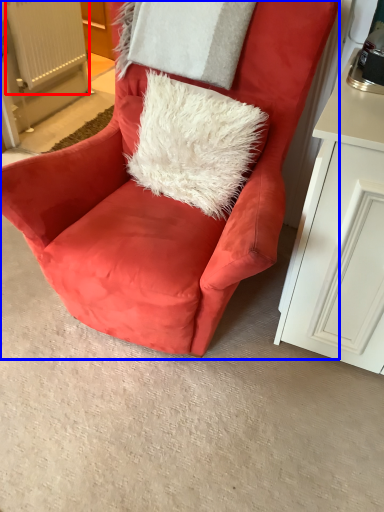
Question: Among these objects, which one is farthest to the camera, radiator (highlighted by a red box) or chair (highlighted by a blue box)?

Choices:
 (A) radiator
 (B) chair

Answer: (A)